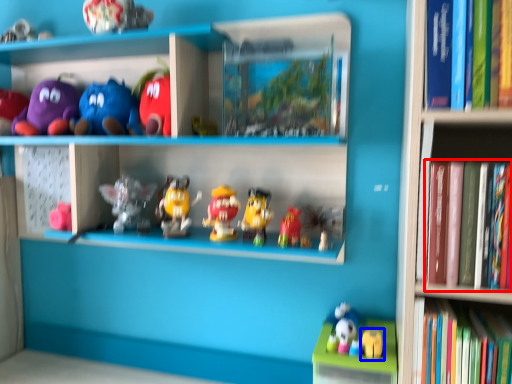
Question: Which of the following is the closest to the observer, book (highlighted by a red box) or toy (highlighted by a blue box)?

Choices:
 (A) book
 (B) toy

Answer: (A)